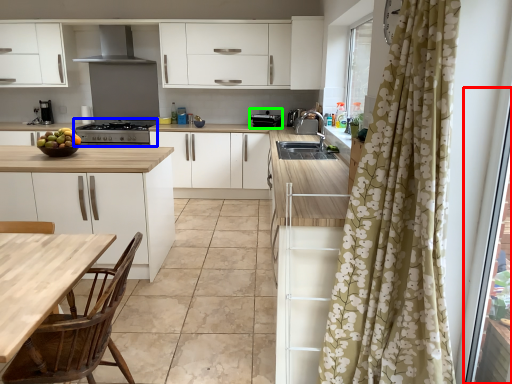
Question: Which object is positioned closest to screen door (highlighted by a red box)? Select from kitchen appliance (highlighted by a blue box) and appliance (highlighted by a green box).

Choices:
 (A) kitchen appliance
 (B) appliance

Answer: (B)